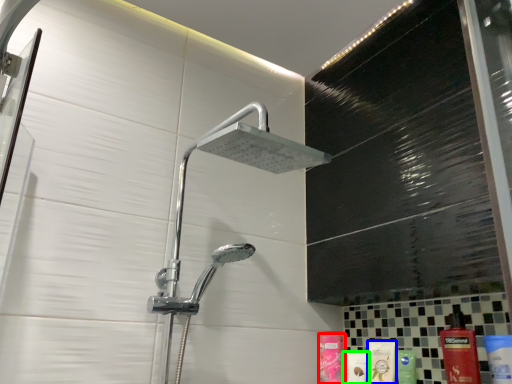
Question: Which is nearer to the toiletry (highlighted by a red box)? mouthwash (highlighted by a blue box) or toiletry (highlighted by a green box).

Choices:
 (A) mouthwash
 (B) toiletry

Answer: (B)